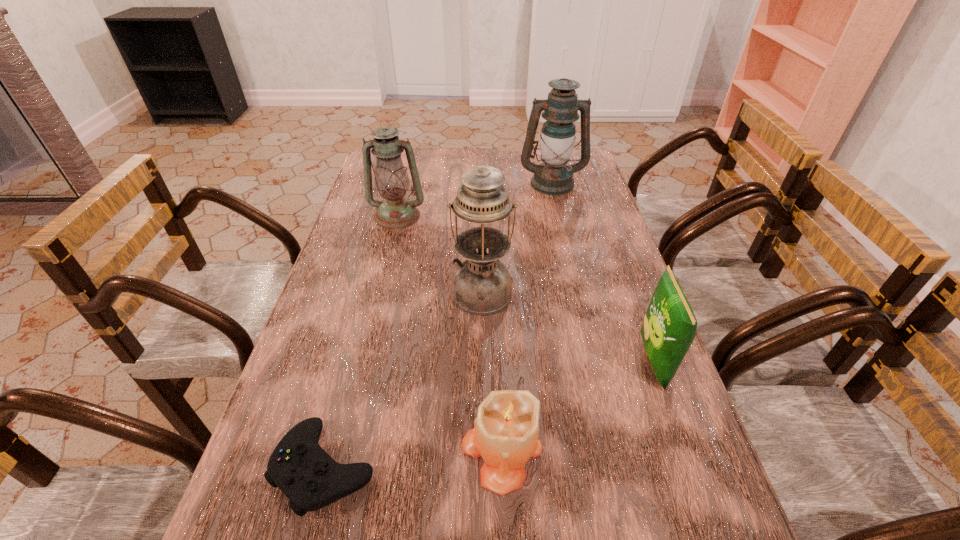
Identify the location of control located at the left edge. This screenshot has height=540, width=960. (310, 478).

Find the location of a particular element. The height and width of the screenshot is (540, 960). oil lamp present at the right edge is located at coordinates (552, 177).

Locate an element on the screen. The height and width of the screenshot is (540, 960). crisp (potato chip) at the right edge is located at coordinates (669, 327).

Locate an element on the screen. object that is at the far right corner is located at coordinates (552, 177).

Image resolution: width=960 pixels, height=540 pixels. Find the location of `vacant space at the far edge of the desktop`. vacant space at the far edge of the desktop is located at coordinates (425, 173).

This screenshot has height=540, width=960. I want to click on vacant space at the left edge of the desktop, so click(x=338, y=265).

Find the location of a particular element. This screenshot has height=540, width=960. vacant space at the right edge is located at coordinates (623, 305).

The width and height of the screenshot is (960, 540). Find the location of `unoccupied position between the fourth tallest object and the farthest oil lamp`. unoccupied position between the fourth tallest object and the farthest oil lamp is located at coordinates (603, 272).

Locate an element on the screen. unoccupied position between the rightmost oil lamp and the fourth nearest object is located at coordinates (517, 238).

Find the location of a particular element. vacant space that's between the second shortest object and the farthest oil lamp is located at coordinates (527, 316).